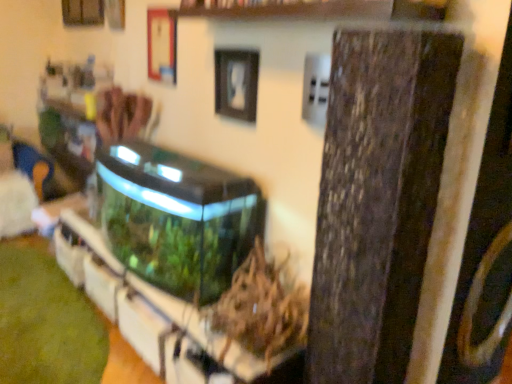
Question: From their relative heights in the image, would you say green matte plant at center is taller or shorter than transparent glass water tank at center?

Choices:
 (A) short
 (B) tall

Answer: (A)

Question: Is green matte plant at center in front of or behind transparent glass water tank at center in the image?

Choices:
 (A) front
 (B) behind

Answer: (A)

Question: Which object is positioned farthest from the transparent glass aquarium at center, acting as the first shelf starting from the bottom?

Choices:
 (A) transparent glass water tank at center
 (B) green matte plant at center
 (C) wooden at upper center, the first shelf positioned from the top
 (D) black matte picture frame at upper center

Answer: (C)

Question: Estimate the real-world distances between objects in this image. Which object is farther from the transparent glass water tank at center?

Choices:
 (A) black matte picture frame at upper center
 (B) green matte plant at center
 (C) wooden at upper center, the first shelf positioned from the top
 (D) transparent glass aquarium at center, acting as the second shelf starting from the top

Answer: (C)